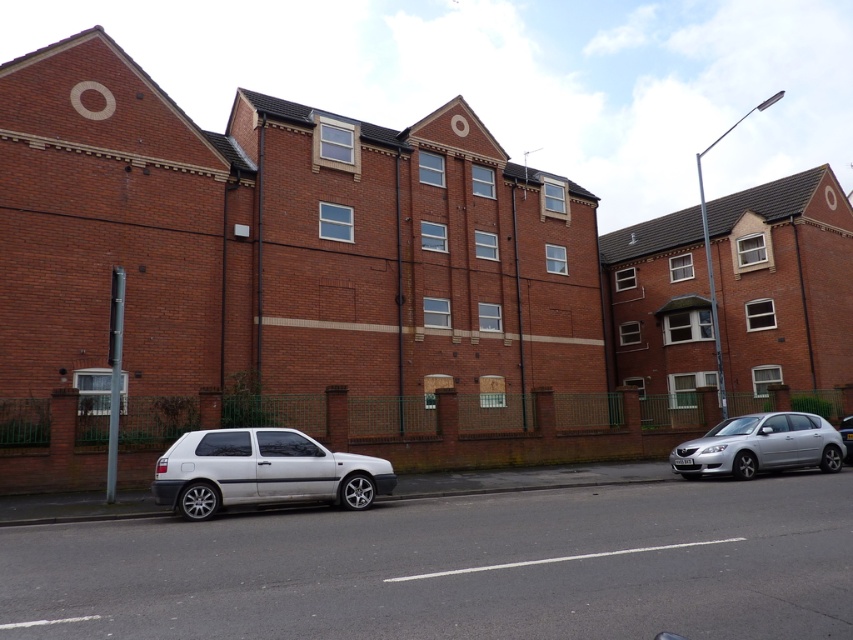
Question: Which object is farther from the camera taking this photo?

Choices:
 (A) silver metallic car at right
 (B) silver metallic hatchback at right

Answer: (A)

Question: In this image, where is silver metallic hatchback at right located relative to silver metallic car at right?

Choices:
 (A) right
 (B) left

Answer: (B)

Question: Is white matte hatchback at lower left further to the viewer compared to silver metallic hatchback at right?

Choices:
 (A) no
 (B) yes

Answer: (A)

Question: Which point is farther from the camera taking this photo?

Choices:
 (A) (840, 424)
 (B) (281, 499)
 (C) (809, 429)

Answer: (A)

Question: Can you confirm if silver metallic hatchback at right is positioned to the right of silver metallic car at right?

Choices:
 (A) no
 (B) yes

Answer: (A)

Question: Which of the following is the farthest from the observer?

Choices:
 (A) (828, 465)
 (B) (849, 452)
 (C) (395, 483)

Answer: (B)